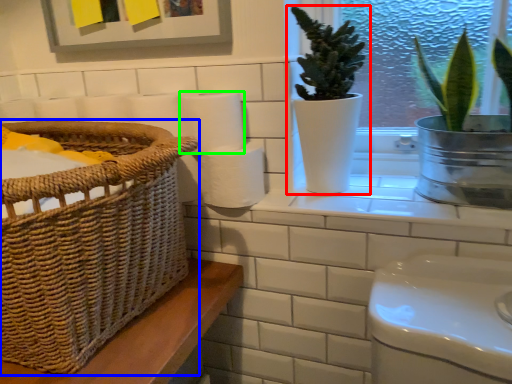
Question: Which is nearer to the houseplant (highlighted by a red box)? basket (highlighted by a blue box) or paper towel (highlighted by a green box).

Choices:
 (A) basket
 (B) paper towel

Answer: (B)